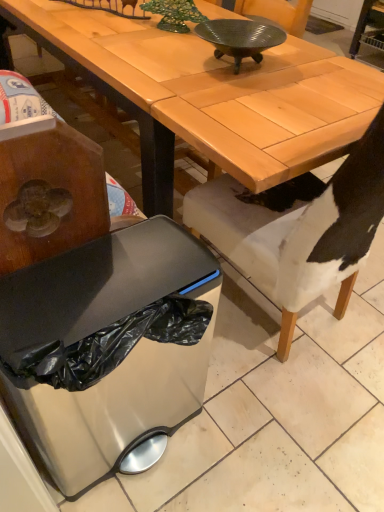
Question: Based on their positions, is satin silver trash can at lower left located to the left or right of white fabric chair at lower right?

Choices:
 (A) left
 (B) right

Answer: (A)

Question: From the image's perspective, is satin silver trash can at lower left located above or below white fabric chair at lower right?

Choices:
 (A) below
 (B) above

Answer: (A)

Question: Which object is the closest to the metallic ribbed bowl at center?

Choices:
 (A) satin silver trash can at lower left
 (B) white fabric chair at lower right
 (C) matte wood desk at center

Answer: (C)

Question: Which object is positioned farthest from the satin silver trash can at lower left?

Choices:
 (A) metallic ribbed bowl at center
 (B) matte wood desk at center
 (C) white fabric chair at lower right

Answer: (A)